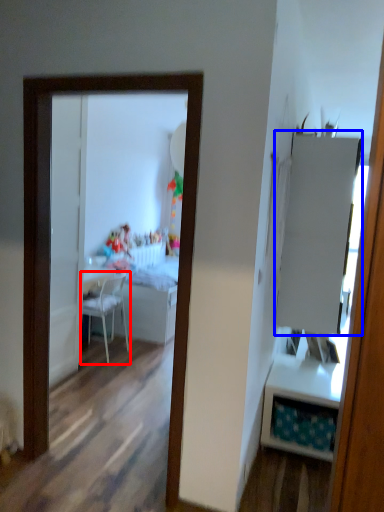
Question: Among these objects, which one is nearest to the camera, chair (highlighted by a red box) or armoire (highlighted by a blue box)?

Choices:
 (A) chair
 (B) armoire

Answer: (B)